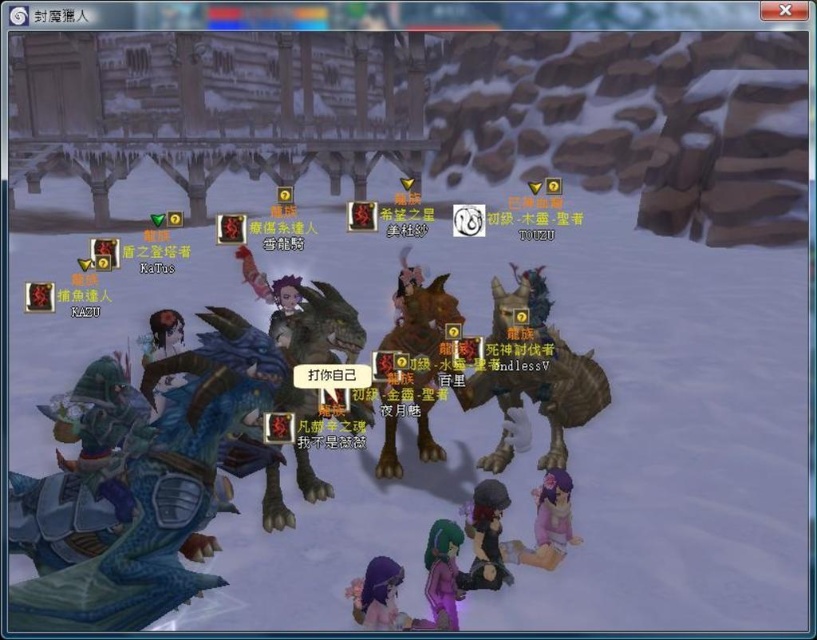
Question: Which point is farther to the camera?

Choices:
 (A) brown furry creature at center
 (B) blue metallic dragon at left

Answer: (A)

Question: Which point is farther from the camera taking this photo?

Choices:
 (A) (176, 436)
 (B) (426, 300)
 (C) (574, 419)

Answer: (C)

Question: Does brown matte creature at right have a smaller size compared to brown furry creature at center?

Choices:
 (A) yes
 (B) no

Answer: (B)

Question: Where is brown matte creature at right located in relation to brown furry creature at center in the image?

Choices:
 (A) below
 (B) above

Answer: (A)

Question: Among these points, which one is farthest from the camera?

Choices:
 (A) (221, 333)
 (B) (561, 387)

Answer: (B)

Question: Is blue metallic dragon at left thinner than brown matte creature at right?

Choices:
 (A) yes
 (B) no

Answer: (A)